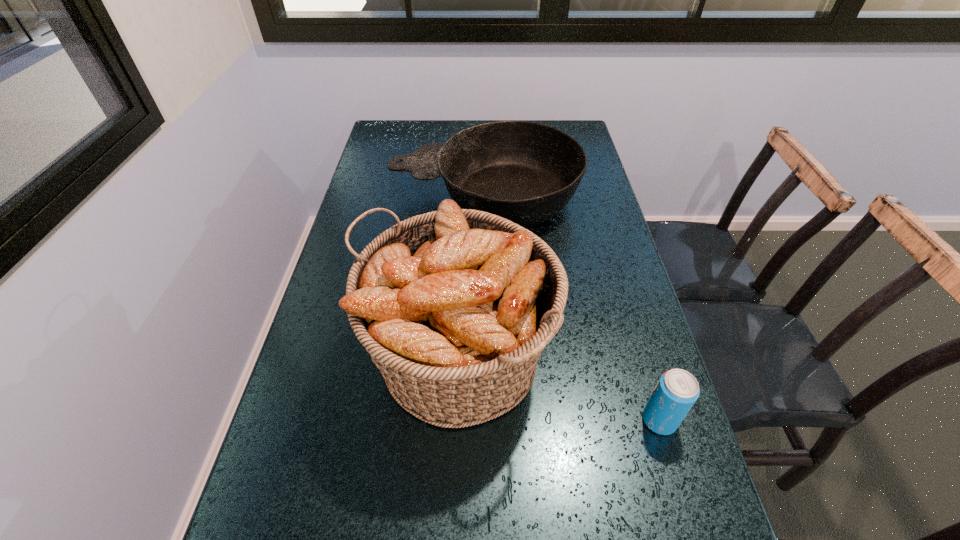
Where is `free point that satisfies the following two spatial constraints: 1. on the back side of the basket; 2. with the handle extending from the side of the farthest object`? free point that satisfies the following two spatial constraints: 1. on the back side of the basket; 2. with the handle extending from the side of the farthest object is located at coordinates (466, 197).